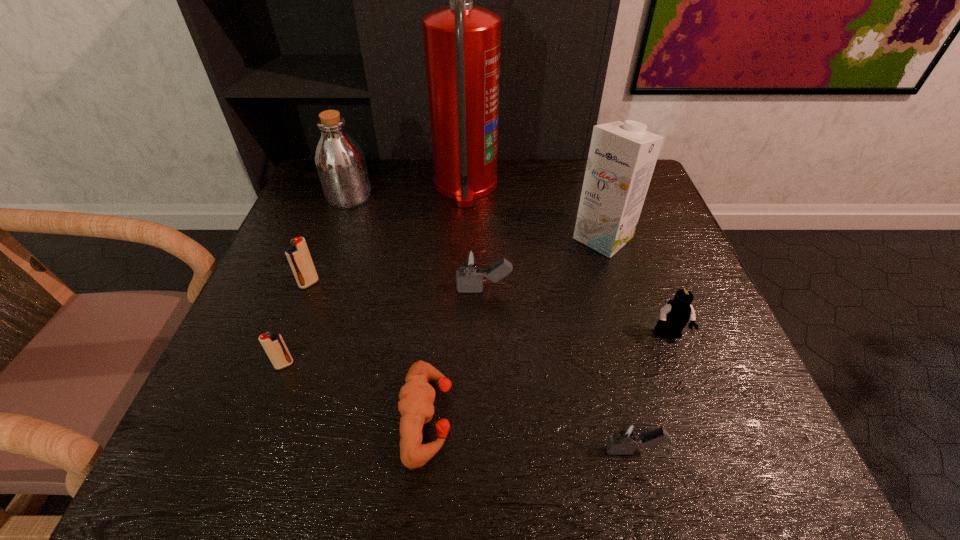
Identify the location of free location located 0.220m on the front of the bigger red igniter. This screenshot has width=960, height=540. (272, 380).

In order to click on vacant space positioned on the front-facing side of the fourth nearest object in this screenshot , I will do `click(713, 454)`.

Find the location of a particular element. This screenshot has height=540, width=960. vacant space located 0.150m on the front of the second nearest igniter is located at coordinates (252, 453).

Identify the location of vacant space located 0.250m on the back of the nearest igniter. pyautogui.click(x=600, y=317).

Where is `blank space located 0.090m with the gloves of the puncher facing forward`? blank space located 0.090m with the gloves of the puncher facing forward is located at coordinates (507, 417).

Locate an element on the screen. The width and height of the screenshot is (960, 540). fire extinguisher at the far edge is located at coordinates (462, 42).

Identify the location of bottle at the far edge. This screenshot has width=960, height=540. (x=340, y=162).

What are the coordinates of `igniter that is at the near edge` in the screenshot? It's located at (626, 436).

Identify the location of puncher present at the near edge. The image size is (960, 540). (417, 396).

The width and height of the screenshot is (960, 540). Find the location of `bottle present at the left edge`. bottle present at the left edge is located at coordinates (340, 162).